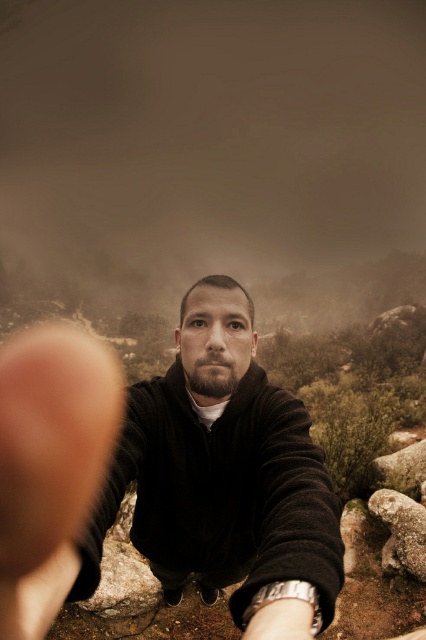
Who is taller, black matte jacket at center or rough textured rock at lower right?

With more height is black matte jacket at center.

Does point (175, 496) come in front of point (423, 552)?

Yes, it is.

Is point (219, 276) farther from camera compared to point (417, 544)?

No, (219, 276) is closer to viewer.

Locate an element on the screen. black matte jacket at center is located at coordinates (221, 470).